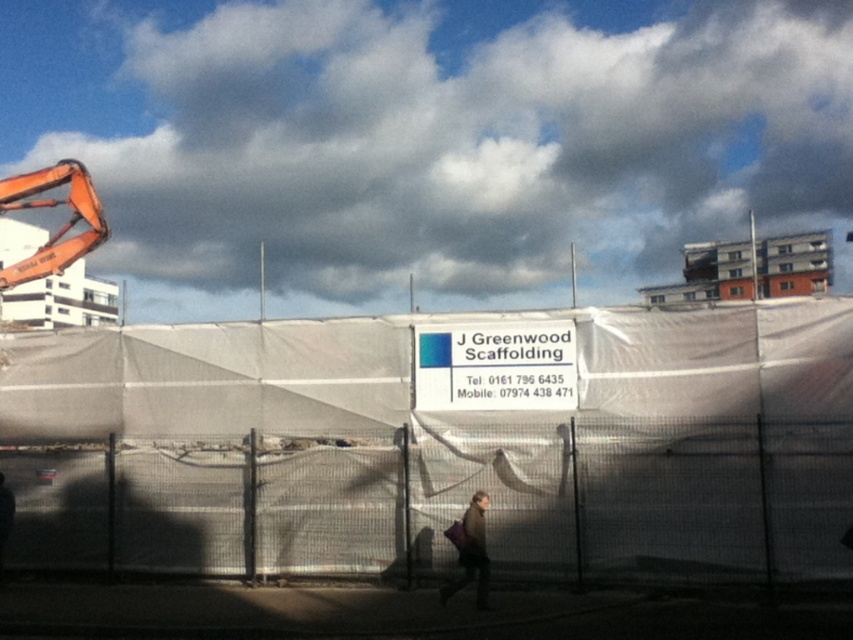
You are a delivery person trying to locate the construction manager. You see a white plastic sign at center and a brown leather jacket at center. Which object is closer to you?

The white plastic sign at center is closer to you because the brown leather jacket at center is behind it.